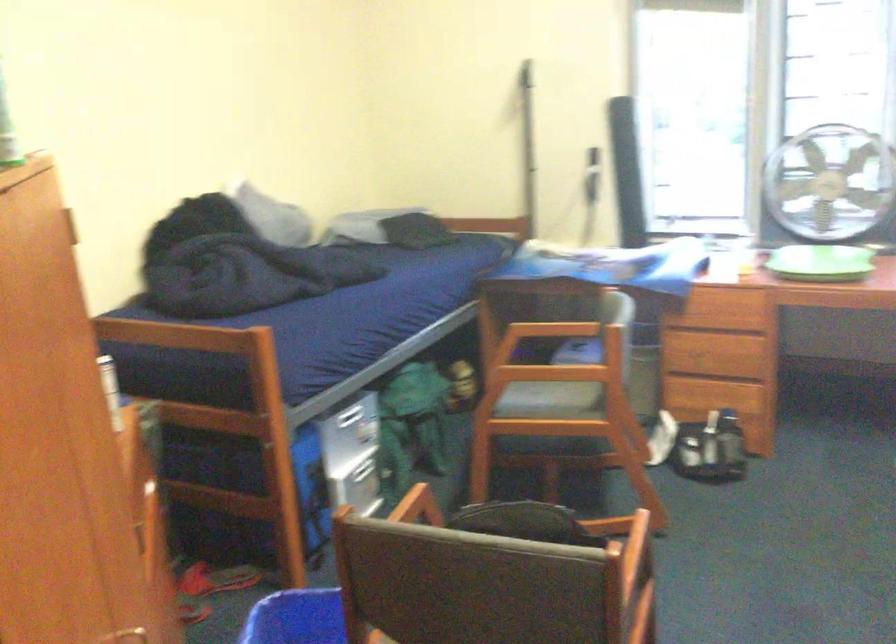
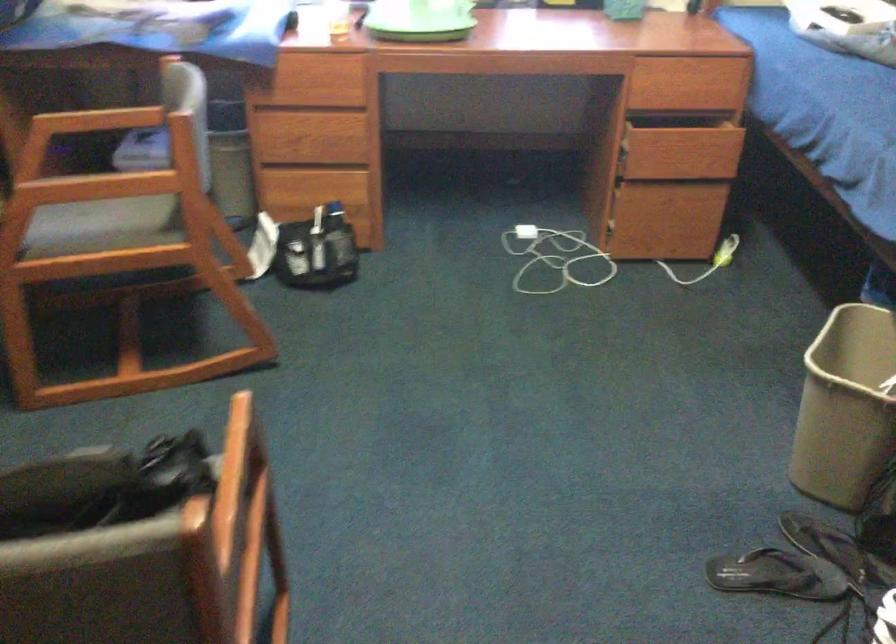
The first image is from the beginning of the video and the second image is from the end. How did the camera likely rotate when shooting the video?

The camera's rotation is toward right-down.